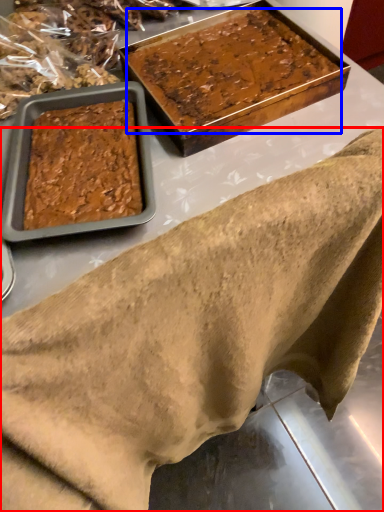
Question: Which object is closer to the camera taking this photo, wrap (highlighted by a red box) or dessert (highlighted by a blue box)?

Choices:
 (A) wrap
 (B) dessert

Answer: (A)